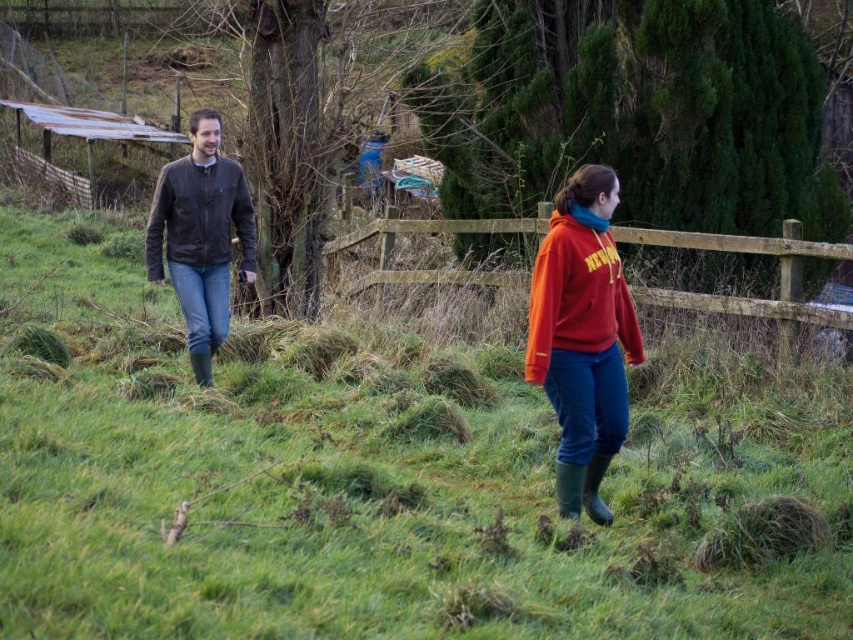
You are a photographer standing behind the two people in the image. You want to take a picture of the green grassy at center and the brown leather jacket at left. Which object should you focus on first if you want to ensure both are in focus?

The green grassy at center is below the brown leather jacket at left, so you should focus on the brown leather jacket at left first to ensure both are in focus.

You are designing a new clothing line and need to know the relative sizes of the matte red hoodie at center and the leather jacket at left. Which item is narrower?

The matte red hoodie at center is narrower than the leather jacket at left.